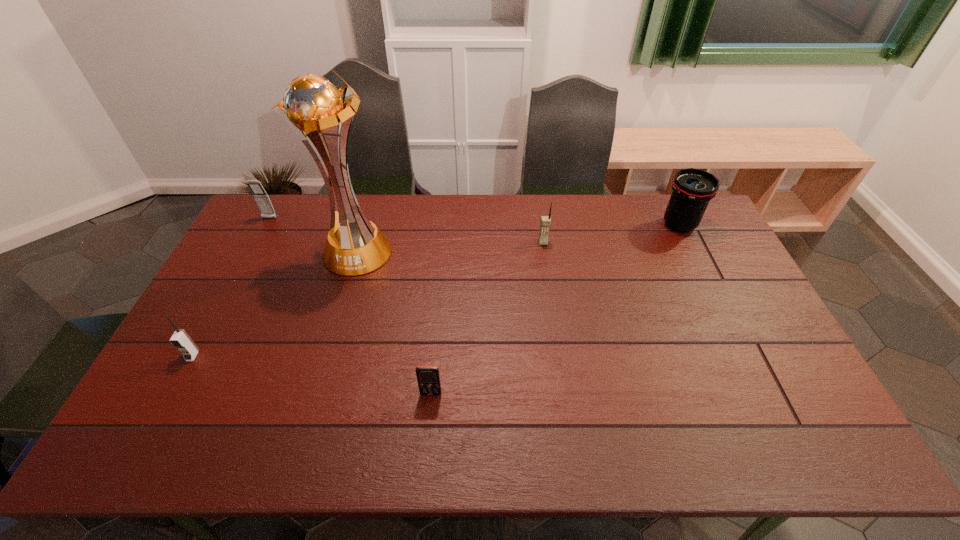
Identify the location of object that is at the far right corner. (692, 188).

Where is `vacant space at the far edge of the desktop`? vacant space at the far edge of the desktop is located at coordinates (413, 213).

The height and width of the screenshot is (540, 960). Identify the location of vacant space at the near edge of the desktop. (379, 441).

Identify the location of vacant area at the left edge. The width and height of the screenshot is (960, 540). (223, 302).

Locate an element on the screen. vacant space at the right edge of the desktop is located at coordinates (730, 272).

Locate an element on the screen. This screenshot has height=540, width=960. vacant space at the far left corner is located at coordinates (293, 201).

In the image, there is a desktop. What are the coordinates of `vacant space at the near left corner` in the screenshot? It's located at (163, 454).

The height and width of the screenshot is (540, 960). In the image, there is a desktop. In order to click on free space at the near right corner in this screenshot , I will do `click(814, 439)`.

You are a GUI agent. You are given a task and a screenshot of the screen. Output one action in this format:
    pyautogui.click(x=<x>, y=<y>)
    Task: Click on the empty space between the farthest cellular telephone and the tallest object
    
    Given the screenshot: What is the action you would take?
    pyautogui.click(x=313, y=235)

Identify the location of empty space that is in between the trophy and the nearest cellular telephone. (394, 322).